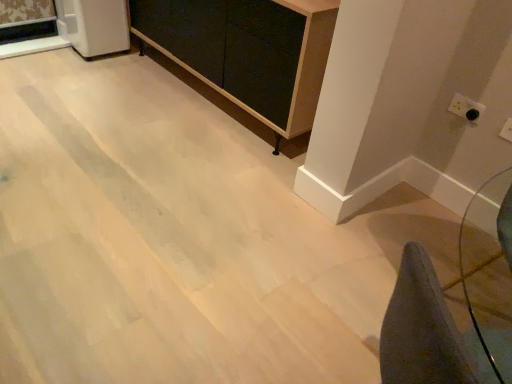
Question: Considering the relative sizes of white plastic electric outlet at upper right, the first electric outlet in the back-to-front sequence, and white plastic electric outlet at upper right, the 2th electric outlet viewed from the back, in the image provided, is white plastic electric outlet at upper right, the first electric outlet in the back-to-front sequence, smaller than white plastic electric outlet at upper right, the 2th electric outlet viewed from the back,?

Choices:
 (A) yes
 (B) no

Answer: (B)

Question: Is white plastic electric outlet at upper right, the first electric outlet in the back-to-front sequence, at the right side of white plastic electric outlet at upper right, arranged as the 2th electric outlet when viewed from the top?

Choices:
 (A) yes
 (B) no

Answer: (B)

Question: Can you confirm if white plastic electric outlet at upper right, placed as the 2th electric outlet when sorted from bottom to top, is wider than white plastic electric outlet at upper right, which is the 2th electric outlet from left to right?

Choices:
 (A) yes
 (B) no

Answer: (A)

Question: From the image's perspective, would you say white plastic electric outlet at upper right, which is counted as the first electric outlet, starting from the top, is positioned over white plastic electric outlet at upper right, placed as the 1th electric outlet when sorted from front to back?

Choices:
 (A) no
 (B) yes

Answer: (B)

Question: Is white plastic electric outlet at upper right, the second electric outlet in the right-to-left sequence, completely or partially outside of white plastic electric outlet at upper right, which is the 2th electric outlet from left to right?

Choices:
 (A) no
 (B) yes

Answer: (B)

Question: Considering the positions of point (66, 21) and point (508, 125), is point (66, 21) closer or farther from the camera than point (508, 125)?

Choices:
 (A) farther
 (B) closer

Answer: (A)

Question: Would you say white glossy refrigerator at upper left is inside or outside white plastic electric outlet at upper right, placed as the 1th electric outlet when sorted from front to back?

Choices:
 (A) outside
 (B) inside

Answer: (A)

Question: Considering the positions of white glossy refrigerator at upper left and white plastic electric outlet at upper right, which is the 1th electric outlet from right to left, in the image, is white glossy refrigerator at upper left wider or thinner than white plastic electric outlet at upper right, which is the 1th electric outlet from right to left,?

Choices:
 (A) wide
 (B) thin

Answer: (A)

Question: Based on their positions, is white glossy refrigerator at upper left located to the left or right of white plastic electric outlet at upper right, which is the 2th electric outlet from left to right?

Choices:
 (A) right
 (B) left

Answer: (B)

Question: Considering the positions of matte black chalkboard at center and white plastic electric outlet at upper right, the 1th electric outlet from the left, in the image, is matte black chalkboard at center wider or thinner than white plastic electric outlet at upper right, the 1th electric outlet from the left,?

Choices:
 (A) thin
 (B) wide

Answer: (B)

Question: Looking at the image, does matte black chalkboard at center seem bigger or smaller compared to white plastic electric outlet at upper right, which appears as the second electric outlet when viewed from the front?

Choices:
 (A) big
 (B) small

Answer: (A)

Question: In terms of height, does matte black chalkboard at center look taller or shorter compared to white plastic electric outlet at upper right, which is counted as the first electric outlet, starting from the top?

Choices:
 (A) tall
 (B) short

Answer: (A)

Question: Visually, is matte black chalkboard at center positioned to the left or to the right of white plastic electric outlet at upper right, the second electric outlet in the right-to-left sequence?

Choices:
 (A) right
 (B) left

Answer: (B)

Question: Does point (314, 107) appear closer or farther from the camera than point (507, 122)?

Choices:
 (A) farther
 (B) closer

Answer: (A)

Question: Looking at the image, does matte black chalkboard at center seem bigger or smaller compared to white plastic electric outlet at upper right, arranged as the 2th electric outlet when viewed from the top?

Choices:
 (A) small
 (B) big

Answer: (B)